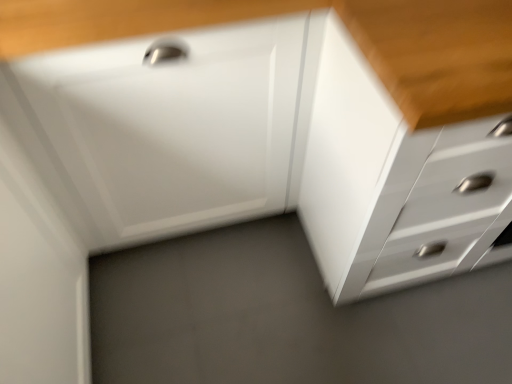
Question: In the image, is white glossy chest of drawers at center positioned in front of or behind white glossy drawer at center?

Choices:
 (A) behind
 (B) front

Answer: (B)

Question: From the image's perspective, relative to white glossy drawer at center, is white glossy chest of drawers at center above or below?

Choices:
 (A) below
 (B) above

Answer: (A)

Question: Based on their positions, is white glossy chest of drawers at center located to the left or right of white glossy drawer at center?

Choices:
 (A) left
 (B) right

Answer: (B)

Question: From the image's perspective, is white glossy drawer at center located above or below white glossy chest of drawers at center?

Choices:
 (A) above
 (B) below

Answer: (A)

Question: Looking at the image, does white glossy drawer at center seem bigger or smaller compared to white glossy chest of drawers at center?

Choices:
 (A) big
 (B) small

Answer: (B)

Question: From a real-world perspective, relative to white glossy chest of drawers at center, is white glossy drawer at center vertically above or below?

Choices:
 (A) below
 (B) above

Answer: (A)

Question: Considering the positions of white glossy drawer at center and white glossy chest of drawers at center in the image, is white glossy drawer at center wider or thinner than white glossy chest of drawers at center?

Choices:
 (A) thin
 (B) wide

Answer: (A)